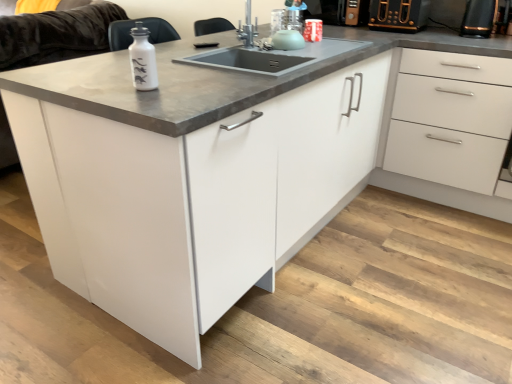
Question: From the image's perspective, is black plastic toaster at upper right, which is counted as the 2th appliance, starting from the left, positioned above or below white glossy cabinet at center?

Choices:
 (A) above
 (B) below

Answer: (A)

Question: In the image, is black plastic toaster at upper right, which is counted as the 2th appliance, starting from the left, positioned in front of or behind white glossy cabinet at center?

Choices:
 (A) behind
 (B) front

Answer: (A)

Question: Considering the real-world distances, which object is closest to the satin nickel faucet at upper center?

Choices:
 (A) black plastic toaster at upper right, placed as the 1th appliance when sorted from left to right
 (B) white matte couch at upper left
 (C) white glossy bottle at upper left
 (D) white glossy cabinet at center
 (E) white glossy drawer at right

Answer: (C)

Question: Which object is positioned closest to the white glossy bottle at upper left?

Choices:
 (A) white glossy cabinet at center
 (B) black plastic toaster at upper right, the 1th appliance when ordered from right to left
 (C) white glossy drawer at right
 (D) satin nickel faucet at upper center
 (E) white matte couch at upper left

Answer: (A)